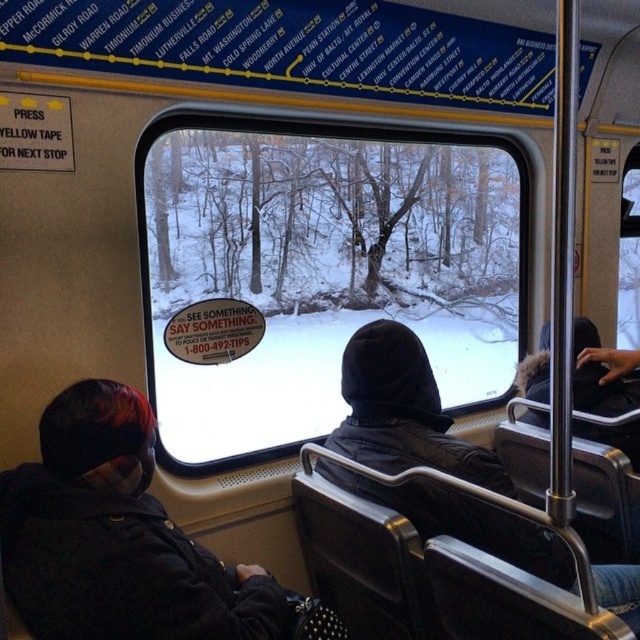
You are inside the transit vehicle and want to know which of the two points, point (76, 531) or point (396, 465), is nearer to you. Based on the scene description, which point is closer?

Point (76, 531) is closer to the camera than point (396, 465), so it is the nearer one.

You are a passenger on this vehicle and want to move from the dark gray jacket at lower left to the black leather jacket at center. How much space is there between them?

The dark gray jacket at lower left is 25.15 inches away from the black leather jacket at center.

You are a passenger on a winter bus ride and want to look outside through the transparent glass window at center. However, your view is blocked by the black leather jacket at center. Can you move the jacket to see outside?

The transparent glass window at center is above the black leather jacket at center, so you can simply look over the jacket to see outside without needing to move it.